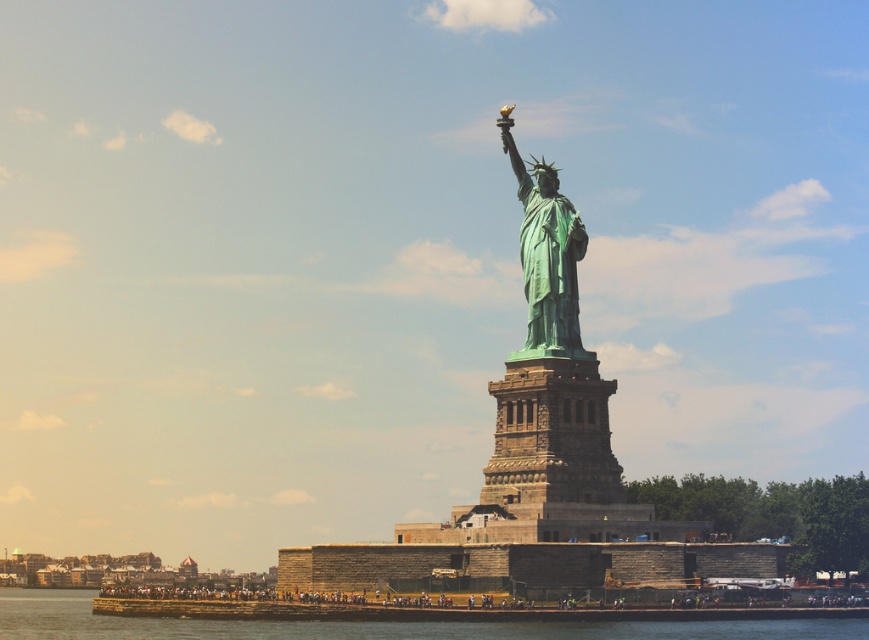
Can you confirm if green patina water at lower center is bigger than green patina statue at center?

Indeed, green patina water at lower center has a larger size compared to green patina statue at center.

Does point (294, 621) lie in front of point (556, 268)?

Yes, point (294, 621) is in front of point (556, 268).

Image resolution: width=869 pixels, height=640 pixels. I want to click on green patina water at lower center, so click(x=375, y=625).